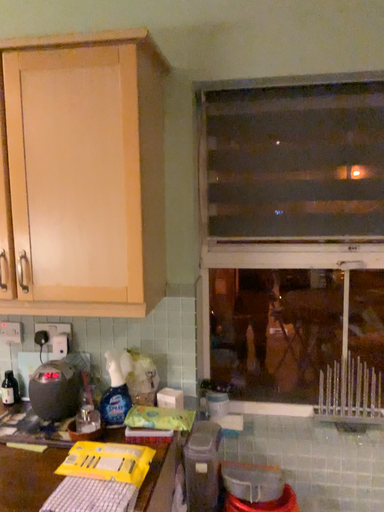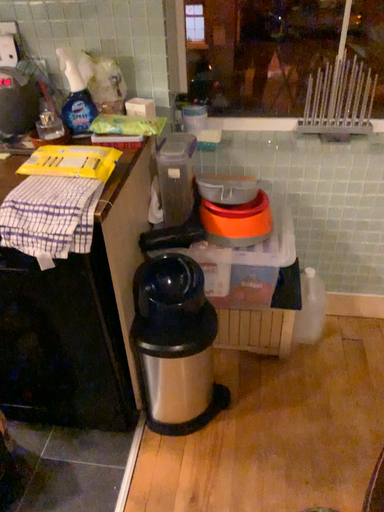
Question: How did the camera likely rotate when shooting the video?

Choices:
 (A) rotated upward
 (B) rotated downward

Answer: (B)